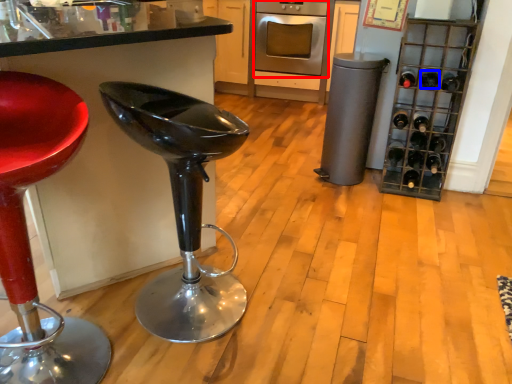
Question: Which object is closer to the camera taking this photo, oven (highlighted by a red box) or wine bottle (highlighted by a blue box)?

Choices:
 (A) oven
 (B) wine bottle

Answer: (B)